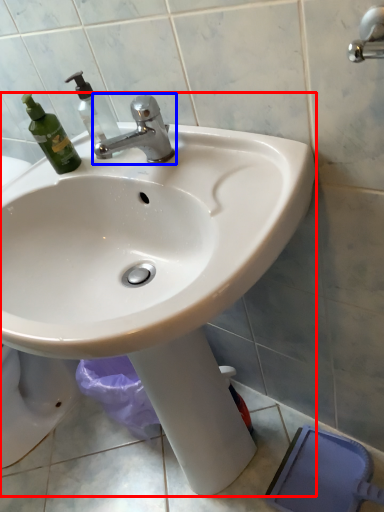
Question: Which point is further to the camera, sink (highlighted by a red box) or tap (highlighted by a blue box)?

Choices:
 (A) sink
 (B) tap

Answer: (B)